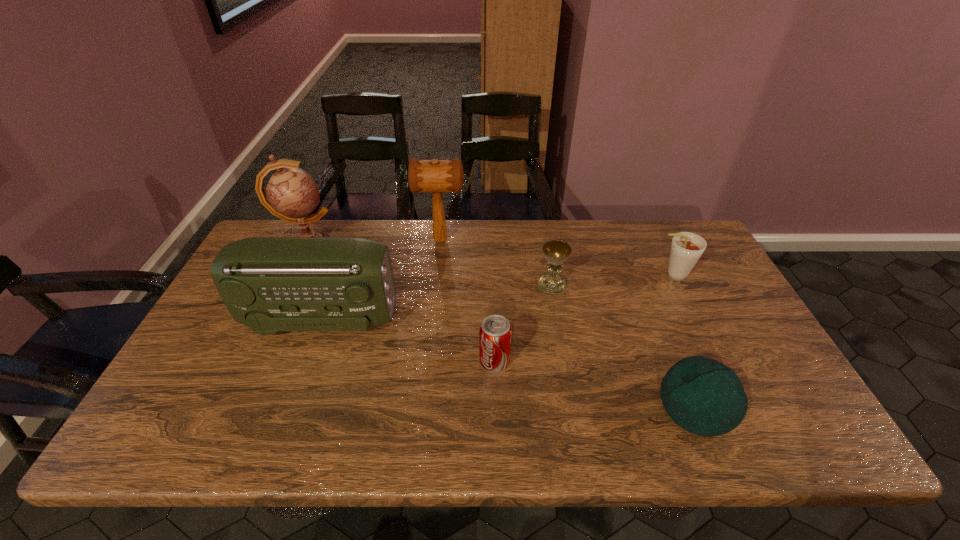
This screenshot has width=960, height=540. In order to click on vacant space situated 0.220m on the strike surface of the mallet in this screenshot , I will do `click(531, 241)`.

Image resolution: width=960 pixels, height=540 pixels. Find the location of `free location located 0.320m on the front-facing side of the fifth farthest object`. free location located 0.320m on the front-facing side of the fifth farthest object is located at coordinates (512, 320).

This screenshot has width=960, height=540. I want to click on free space located 0.120m on the drink side of the root beer, so click(613, 275).

Where is `free space located 0.210m on the drink side of the root beer`? Image resolution: width=960 pixels, height=540 pixels. free space located 0.210m on the drink side of the root beer is located at coordinates (584, 275).

Find the location of `free space located 0.300m on the drink side of the root beer`. free space located 0.300m on the drink side of the root beer is located at coordinates (554, 275).

Find the location of a particular element. The height and width of the screenshot is (540, 960). free region located on the right of the fifth object from left to right is located at coordinates pyautogui.click(x=624, y=285).

You are a GUI agent. You are given a task and a screenshot of the screen. Output one action in this format:
    pyautogui.click(x=<x>, y=<y>)
    Task: Click on the vacant point located 0.080m on the back of the fourth object from left to right
    The height and width of the screenshot is (540, 960).
    Given the screenshot: What is the action you would take?
    pyautogui.click(x=493, y=326)

The height and width of the screenshot is (540, 960). I want to click on vacant space located 0.120m on the right of the nearest object, so click(x=786, y=406).

This screenshot has width=960, height=540. In order to click on globe present at the far edge in this screenshot , I will do `click(291, 194)`.

The height and width of the screenshot is (540, 960). Find the location of `mallet located in the far edge section of the desktop`. mallet located in the far edge section of the desktop is located at coordinates (436, 176).